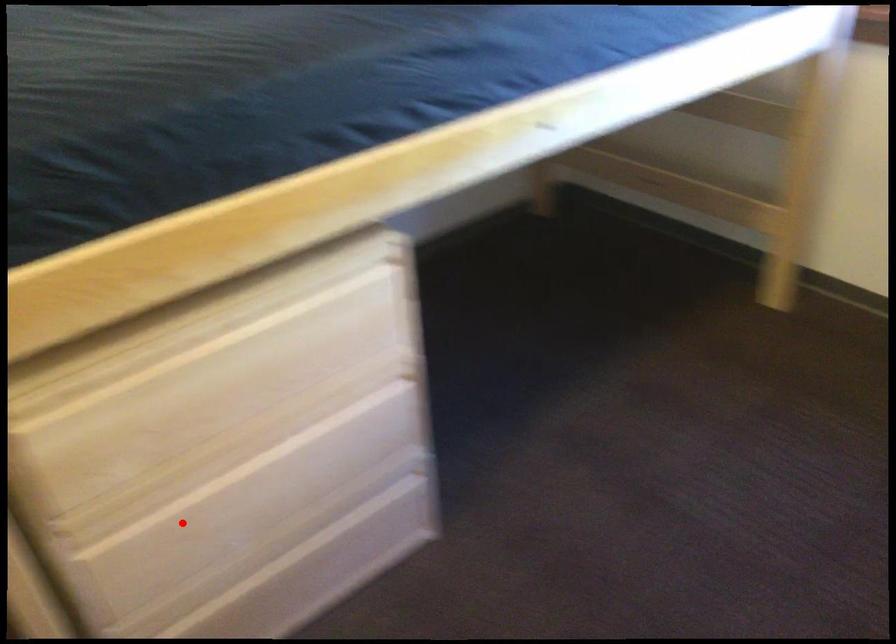
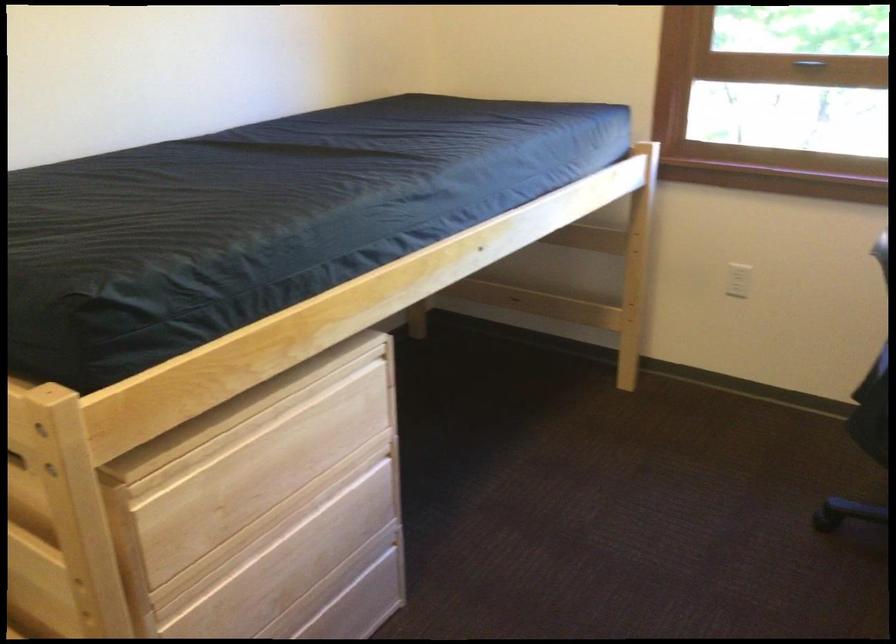
Question: I am providing you with two images of the same scene from different viewpoints. Image1 has a red point marked. In image2, the corresponding 3D location appears at what relative position? Reply with the corresponding letter.

Choices:
 (A) Closer
 (B) Farther

Answer: (B)